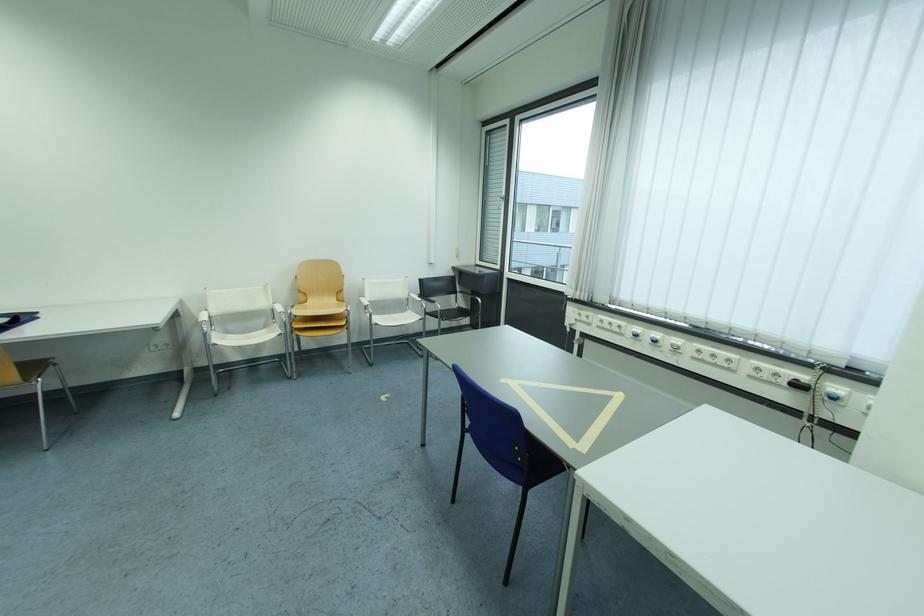
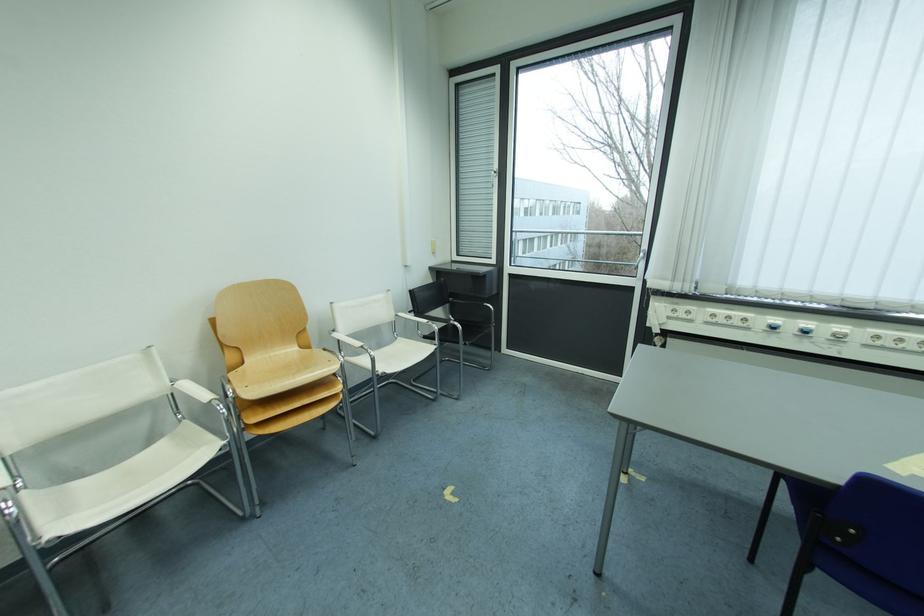
Locate, in the second image, the point that corresponds to pixel 371 301 in the first image.

(344, 338)